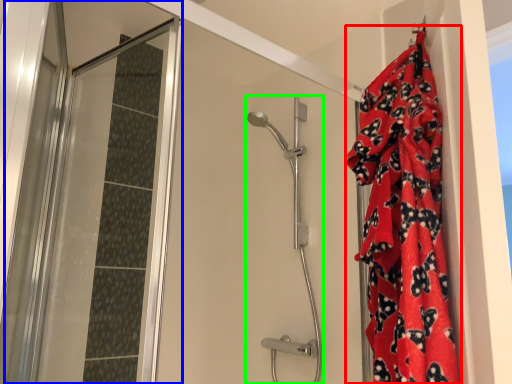
Question: Estimate the real-world distances between objects in this image. Which object is closer to blanket (highlighted by a red box), screen door (highlighted by a blue box) or shower door (highlighted by a green box)?

Choices:
 (A) screen door
 (B) shower door

Answer: (B)